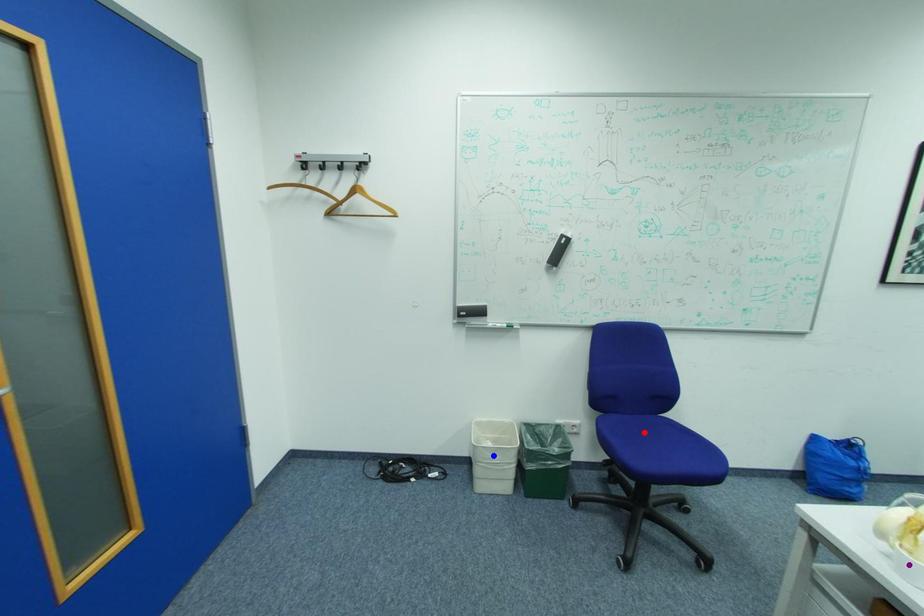
Order these from farthest to nearest:
red point | blue point | purple point

blue point < red point < purple point